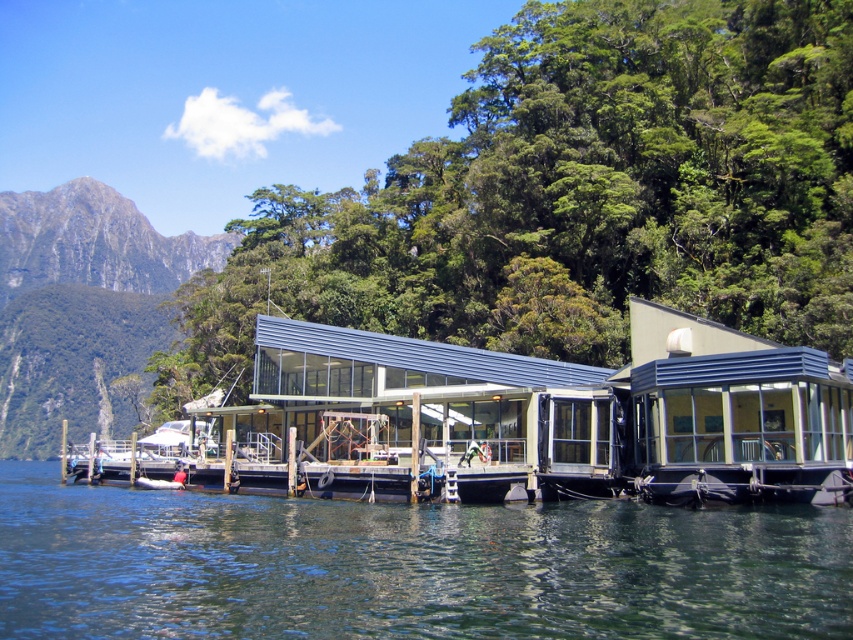
Question: Which of these objects is positioned farthest from the matte glass building at center?

Choices:
 (A) green rock at left
 (B) transparent water at lower center

Answer: (A)

Question: Which point is farther to the camera?

Choices:
 (A) (711, 358)
 (B) (132, 332)

Answer: (B)

Question: Estimate the real-world distances between objects in this image. Which object is farther from the matte glass building at center?

Choices:
 (A) green rock at left
 (B) transparent water at lower center

Answer: (A)

Question: Where is matte glass building at center located in relation to green rock at left in the image?

Choices:
 (A) below
 (B) above

Answer: (A)

Question: Is transparent water at lower center to the right of green rock at left from the viewer's perspective?

Choices:
 (A) no
 (B) yes

Answer: (B)

Question: Can you confirm if transparent water at lower center is bigger than green rock at left?

Choices:
 (A) no
 (B) yes

Answer: (A)